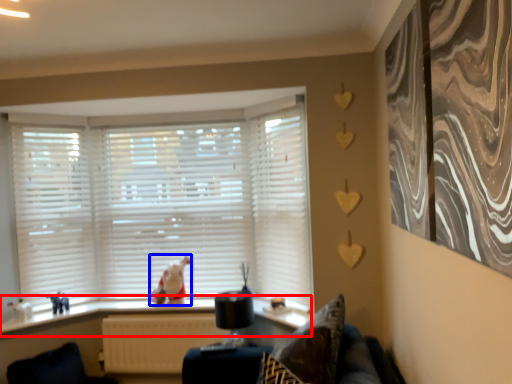
Question: Among these objects, which one is farthest to the camera, window sill (highlighted by a red box) or animal (highlighted by a blue box)?

Choices:
 (A) window sill
 (B) animal

Answer: (B)